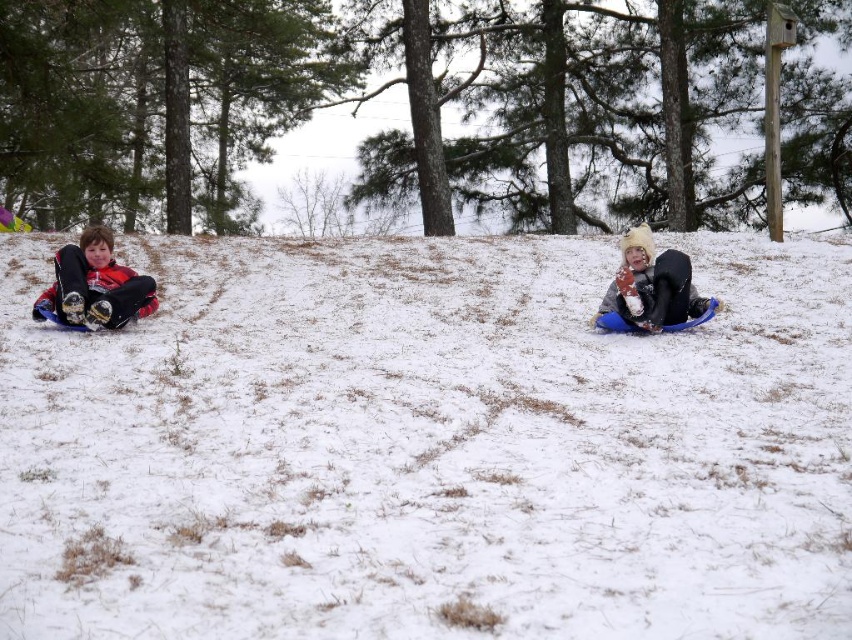
Question: Which point is closer to the camera?

Choices:
 (A) (671, 278)
 (B) (83, 321)
 (C) (58, 358)

Answer: (C)

Question: Which object is the farthest from the fluffy white snowsuit at center?

Choices:
 (A) matte black snowsuit at left
 (B) white fluffy snow at center

Answer: (A)

Question: Estimate the real-world distances between objects in this image. Which object is closer to the matte black snowsuit at left?

Choices:
 (A) white fluffy snow at center
 (B) fluffy white snowsuit at center

Answer: (A)

Question: Is white fluffy snow at center to the right of fluffy white snowsuit at center from the viewer's perspective?

Choices:
 (A) no
 (B) yes

Answer: (A)

Question: Can you confirm if white fluffy snow at center is bigger than fluffy white snowsuit at center?

Choices:
 (A) no
 (B) yes

Answer: (B)

Question: Observing the image, what is the correct spatial positioning of matte black snowsuit at left in reference to fluffy white snowsuit at center?

Choices:
 (A) left
 (B) right

Answer: (A)